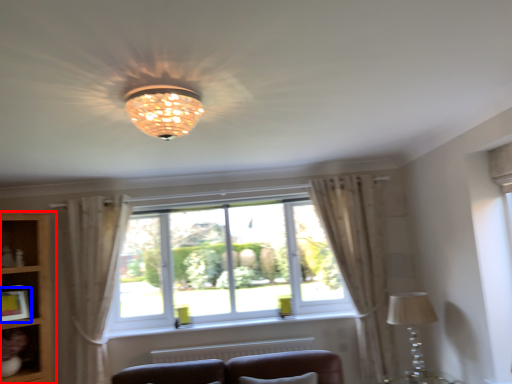
Question: Which object appears farthest to the camera in this image, bookshelf (highlighted by a red box) or picture frame (highlighted by a blue box)?

Choices:
 (A) bookshelf
 (B) picture frame

Answer: (B)